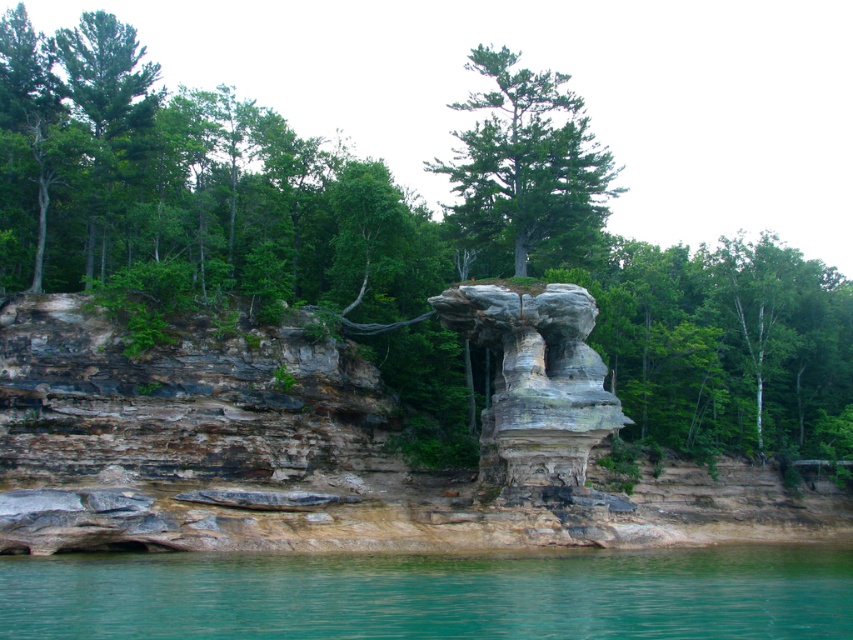
Who is higher up, green leafy tree at center or green matte tree at center?

green leafy tree at center is above.

In the scene shown: Is green leafy tree at center bigger than green matte tree at center?

Correct, green leafy tree at center is larger in size than green matte tree at center.

You are a GUI agent. You are given a task and a screenshot of the screen. Output one action in this format:
    pyautogui.click(x=<x>, y=<y>)
    Task: Click on the green leafy tree at center
    The height and width of the screenshot is (640, 853).
    Given the screenshot: What is the action you would take?
    pyautogui.click(x=403, y=244)

Can you confirm if teal water at lower center is positioned below green matte tree at center?

Yes, teal water at lower center is below green matte tree at center.

Does teal water at lower center have a lesser height compared to green matte tree at center?

Yes.

Is point (607, 557) in front of point (573, 170)?

Yes, point (607, 557) is in front of point (573, 170).

Identify the location of teal water at lower center. Image resolution: width=853 pixels, height=640 pixels. [x=434, y=595].

Locate an element on the screen. Image resolution: width=853 pixels, height=640 pixels. green leafy tree at center is located at coordinates (403, 244).

The width and height of the screenshot is (853, 640). I want to click on green leafy tree at center, so click(403, 244).